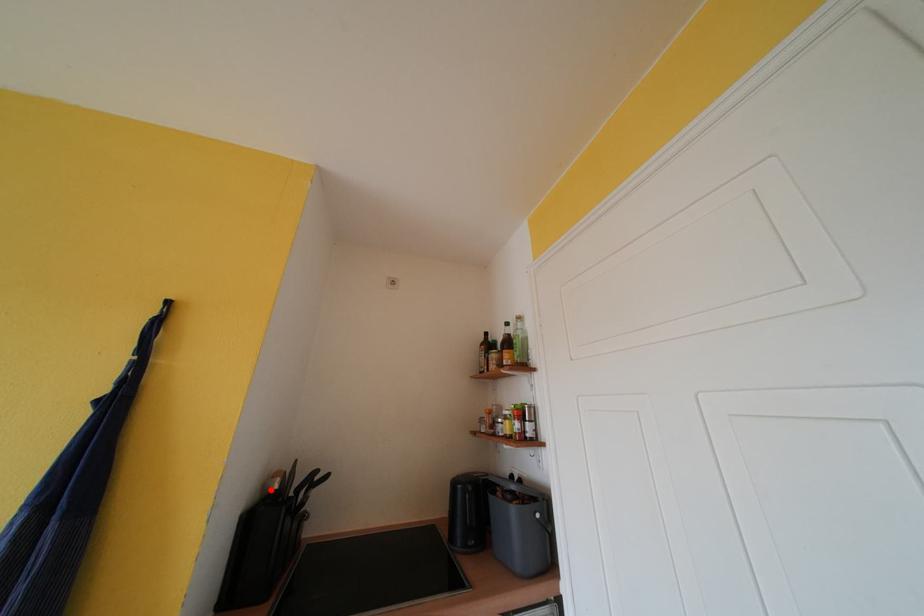
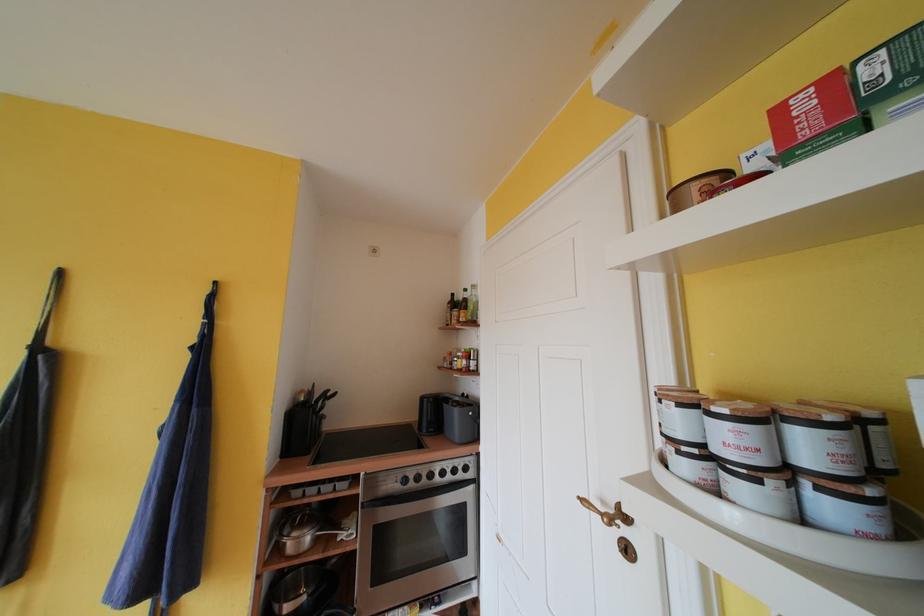
Find the pixel in the second image that matches the highlighted location in the first image.

(301, 402)